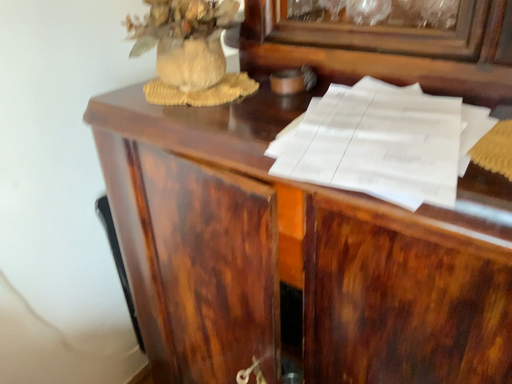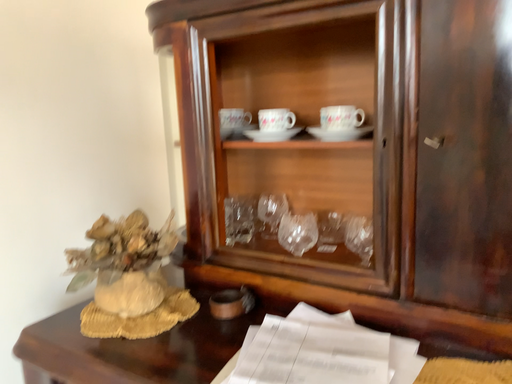
Question: How did the camera likely rotate when shooting the video?

Choices:
 (A) rotated upward
 (B) rotated downward

Answer: (A)